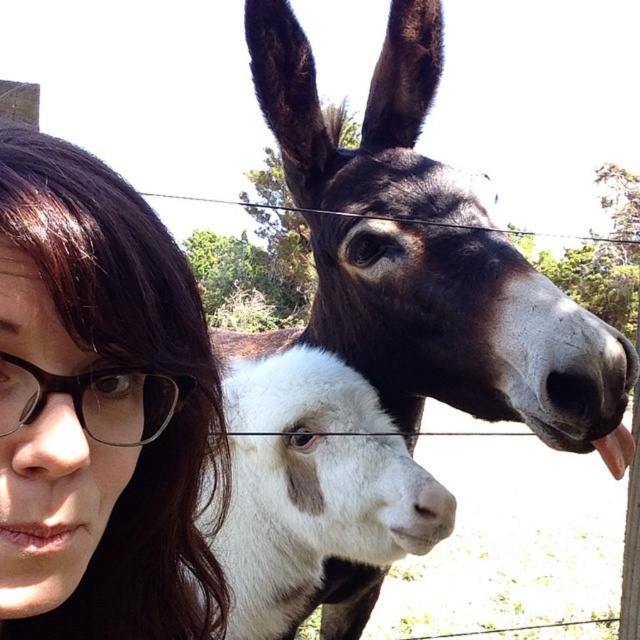
You are a photographer trying to capture a group photo of the brown hair at left and the white woolen goat at center. Since you want to ensure both subjects are in the frame, which direction should you move the camera to include both?

The brown hair at left is to the left of the white woolen goat at center, so you should move the camera to the left to include both subjects in the frame.

Where is the white woolen goat at center located in the image?

The white woolen goat at center is located at point (x=312, y=484).

Where is the brown hair at left located in the image?

The brown hair at left is located at point (99, 408).